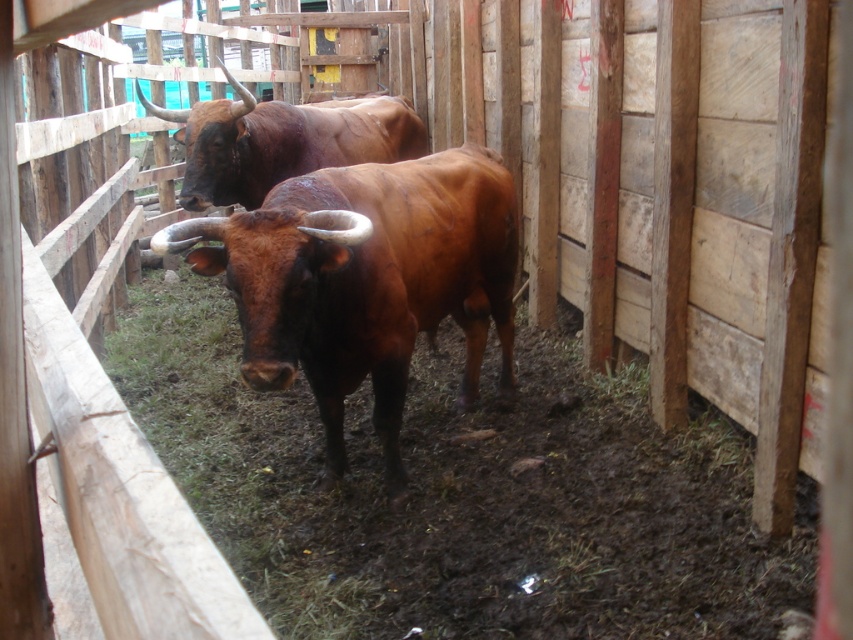
Question: Which of the following is the farthest from the observer?

Choices:
 (A) (403, 108)
 (B) (405, 264)

Answer: (A)

Question: Which point appears farthest from the camera in this image?

Choices:
 (A) (354, 134)
 (B) (399, 234)

Answer: (A)

Question: Is brown glossy bull at center smaller than brown glossy bull at upper center?

Choices:
 (A) yes
 (B) no

Answer: (A)

Question: Can you confirm if brown glossy bull at center is wider than brown glossy bull at upper center?

Choices:
 (A) no
 (B) yes

Answer: (A)

Question: Which object appears farthest from the camera in this image?

Choices:
 (A) brown glossy bull at upper center
 (B) brown glossy bull at center

Answer: (A)

Question: Does brown glossy bull at center have a lesser width compared to brown glossy bull at upper center?

Choices:
 (A) yes
 (B) no

Answer: (A)